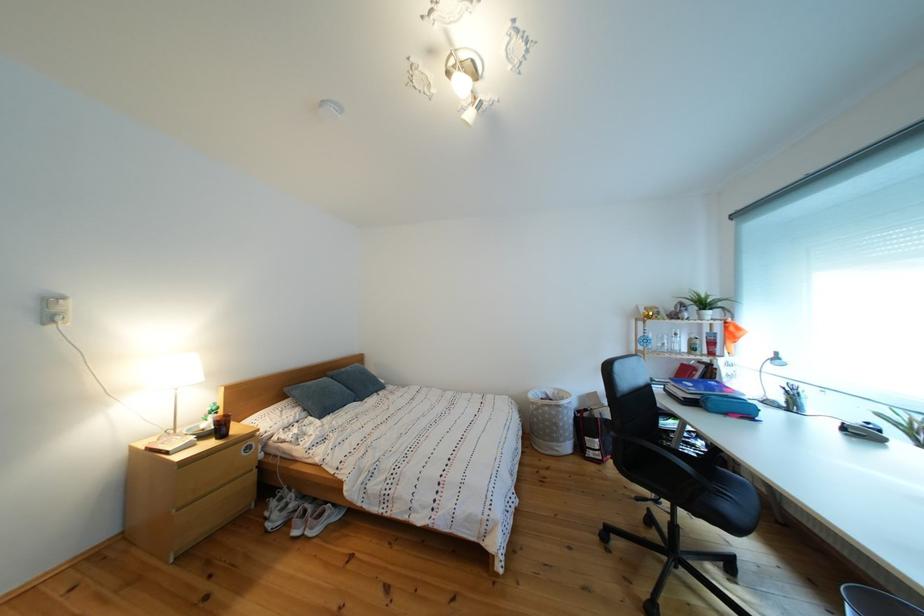
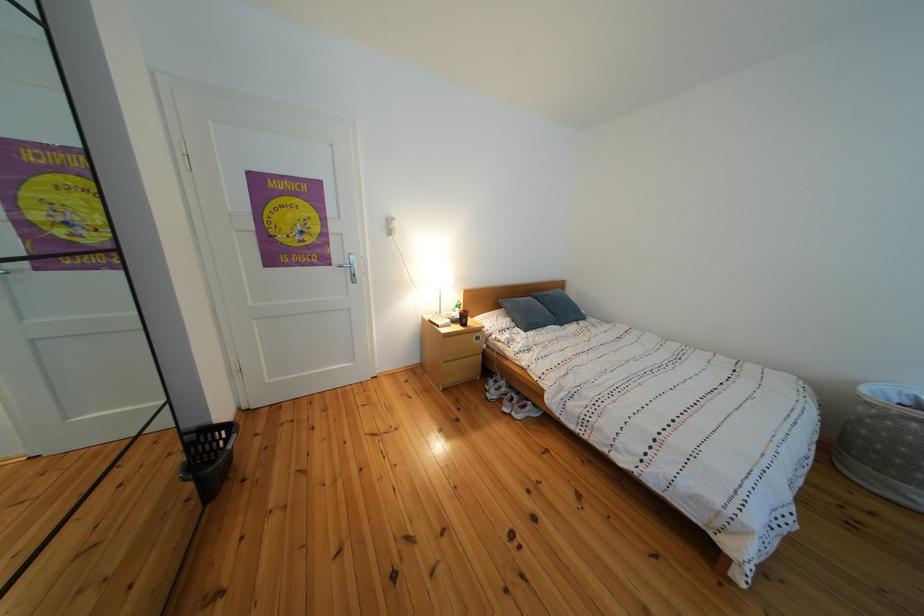
The point at (x=337, y=521) is marked in the first image. Where is the corresponding point in the second image?

(540, 414)